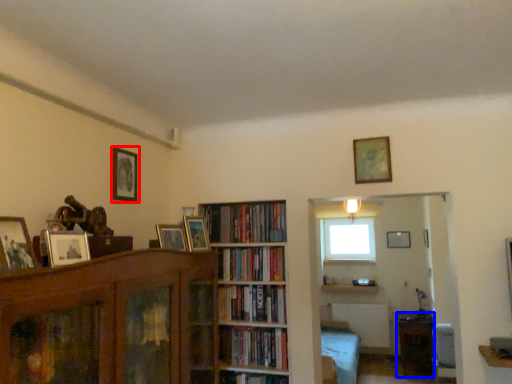
Question: Which of the following is the farthest to the observer, picture frame (highlighted by a red box) or table (highlighted by a blue box)?

Choices:
 (A) picture frame
 (B) table

Answer: (B)